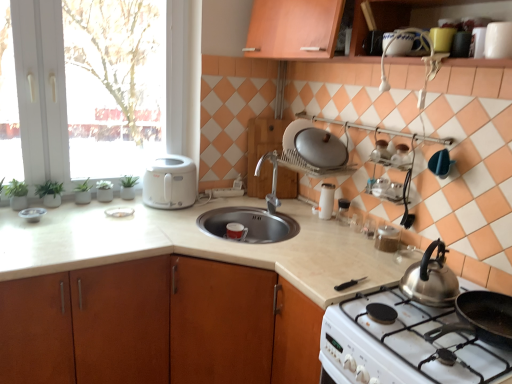
Identify the location of vacant area that is in front of clear glass salt and pepper shakers at center, the 1th appliance in the back-to-front sequence. tap(339, 231).